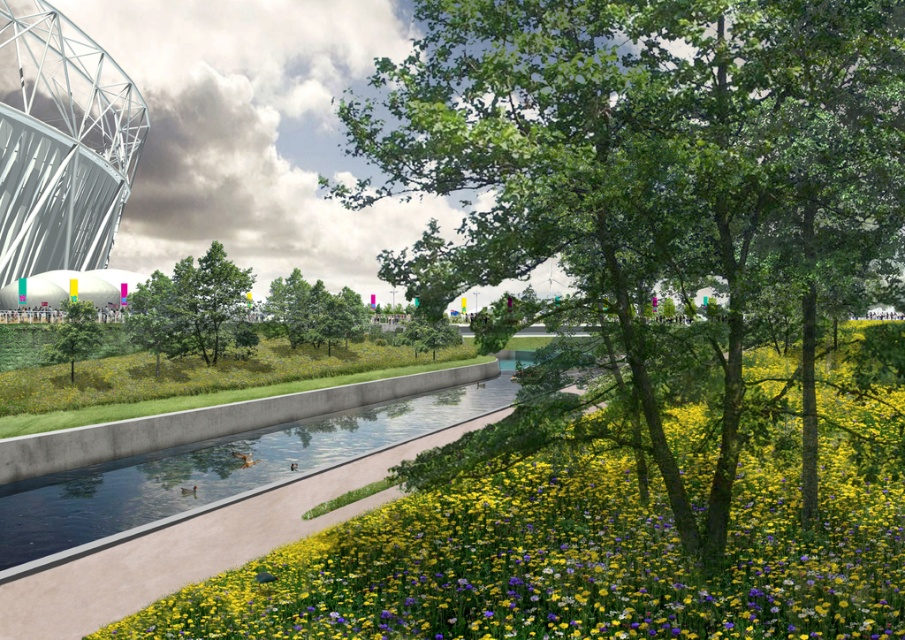
Question: Can you confirm if green leafy tree at center is positioned to the left of green matte tree at center?

Choices:
 (A) no
 (B) yes

Answer: (B)

Question: Among these objects, which one is farthest from the camera?

Choices:
 (A) green matte tree at center
 (B) clear concrete water at center
 (C) yellow matte flower at center
 (D) green matte tree at left

Answer: (A)

Question: Does yellow matte flower at center lie behind green matte tree at left?

Choices:
 (A) yes
 (B) no

Answer: (B)

Question: Does yellow matte flower at center appear on the left side of clear concrete water at center?

Choices:
 (A) yes
 (B) no

Answer: (B)

Question: Which point appears closest to the camera in this image?

Choices:
 (A) (298, 449)
 (B) (291, 337)
 (C) (782, 493)

Answer: (C)

Question: Which point appears farthest from the camera in this image?

Choices:
 (A) (115, 509)
 (B) (275, 330)
 (C) (186, 305)
 (D) (81, 333)

Answer: (B)